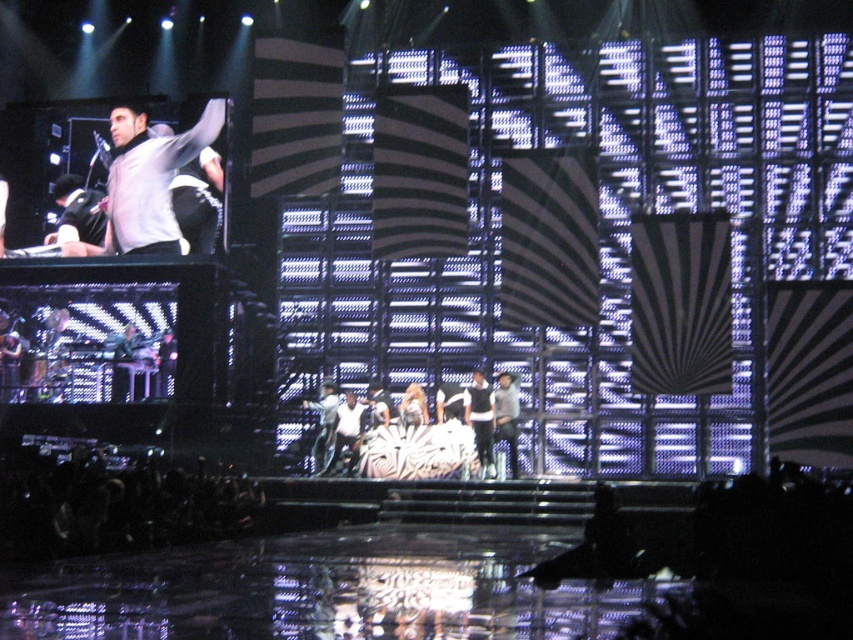
Question: Is white fabric at center smaller than matte gray hoodie at upper left?

Choices:
 (A) yes
 (B) no

Answer: (B)

Question: Estimate the real-world distances between objects in this image. Which object is farther from the white cotton shirt at center?

Choices:
 (A) white leather pants at center
 (B) white fabric at center
 (C) matte gray hoodie at upper left

Answer: (C)

Question: Which point appears closest to the camera in this image?

Choices:
 (A) (490, 440)
 (B) (148, 212)

Answer: (A)

Question: Can you confirm if matte gray hoodie at upper left is smaller than denim jeans at center?

Choices:
 (A) no
 (B) yes

Answer: (A)

Question: Does white fabric at center come in front of denim jeans at center?

Choices:
 (A) no
 (B) yes

Answer: (B)

Question: Which is nearer to the denim jeans at center?

Choices:
 (A) white cotton shirt at center
 (B) matte gray hoodie at upper left
 (C) white leather pants at center
 (D) white fabric at center

Answer: (A)